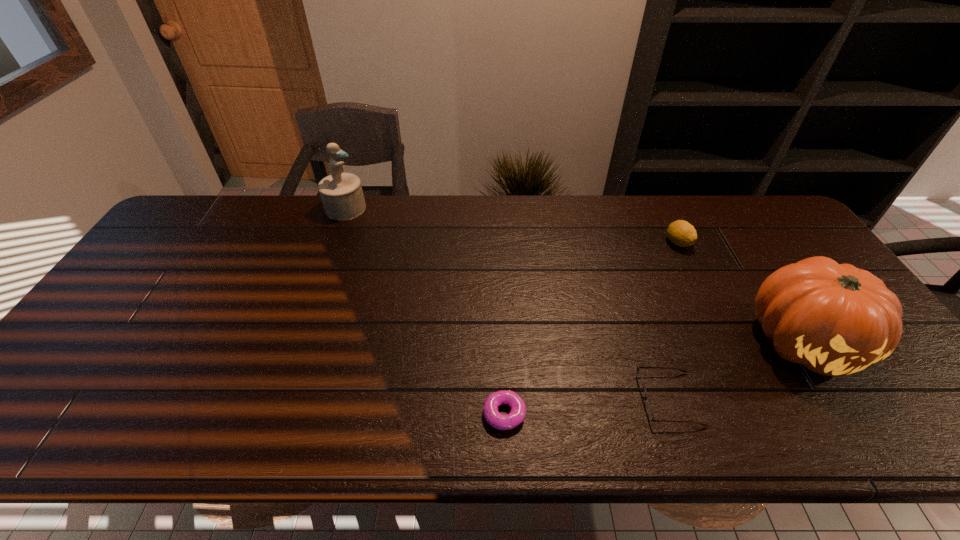
Where is `vacant space situated 0.290m on the front-facing side of the spectacles`? This screenshot has height=540, width=960. vacant space situated 0.290m on the front-facing side of the spectacles is located at coordinates (513, 399).

Identify the location of free space located on the front-facing side of the spectacles. (566, 399).

The width and height of the screenshot is (960, 540). What are the coordinates of `free space located 0.080m on the front-facing side of the spectacles` in the screenshot? It's located at (607, 399).

Identify the location of figurine present at the far edge. The width and height of the screenshot is (960, 540). (341, 193).

Where is `lemon that is at the far edge`? The height and width of the screenshot is (540, 960). lemon that is at the far edge is located at coordinates (681, 233).

The width and height of the screenshot is (960, 540). In order to click on doughnut located in the near edge section of the desktop in this screenshot , I will do `click(497, 420)`.

At what (x,y) coordinates should I click in order to perform the action: click on spectacles that is positioned at the near edge. Please return your answer as a coordinate pair (x, y). This screenshot has height=540, width=960. Looking at the image, I should click on (648, 407).

Image resolution: width=960 pixels, height=540 pixels. Find the location of `object that is at the right edge`. object that is at the right edge is located at coordinates point(835,319).

In the image, there is a desktop. Find the location of `vacant space at the far edge`. vacant space at the far edge is located at coordinates (632, 213).

The height and width of the screenshot is (540, 960). Find the location of `vacant region at the near edge of the desktop`. vacant region at the near edge of the desktop is located at coordinates (668, 415).